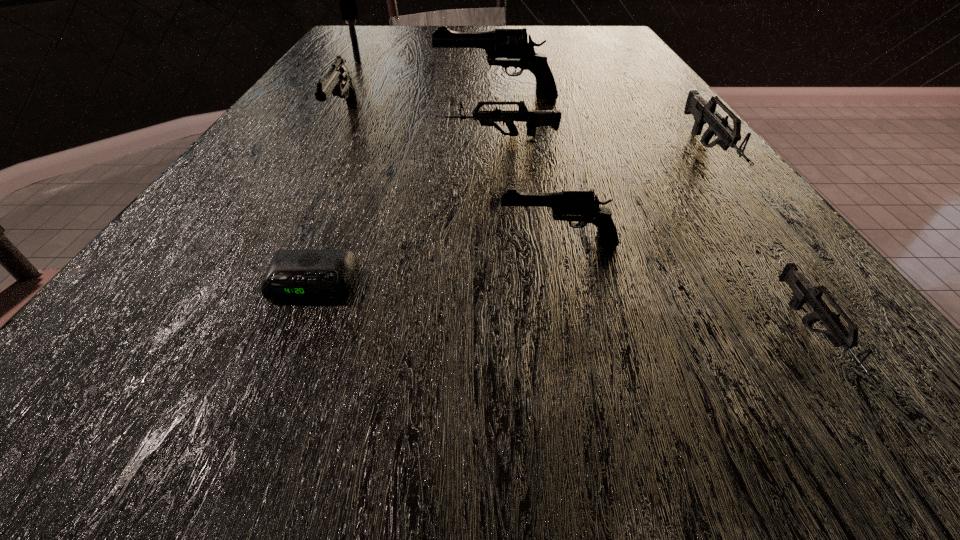
The height and width of the screenshot is (540, 960). I want to click on vacant area situated 0.120m at the end of the barrel of the third nearest object, so click(412, 244).

Identify the location of vacant region located 0.180m at the end of the barrel of the third nearest object. The image size is (960, 540). (369, 244).

The width and height of the screenshot is (960, 540). Identify the location of vacant area situated 0.180m at the end of the barrel of the third nearest object. (369, 244).

Locate an element on the screen. This screenshot has height=540, width=960. vacant position located 0.060m aimed along the barrel of the rightmost gun is located at coordinates (758, 213).

Identify the location of free space located 0.240m aimed along the barrel of the second smallest grey gun. (321, 136).

Locate an element on the screen. The height and width of the screenshot is (540, 960). free space located aimed along the barrel of the second smallest grey gun is located at coordinates (284, 136).

Locate an element on the screen. Image resolution: width=960 pixels, height=540 pixels. free space located aimed along the barrel of the second smallest grey gun is located at coordinates (316, 136).

Identify the location of free location located on the display of the alarm clock. The image size is (960, 540). pyautogui.click(x=254, y=427).

The width and height of the screenshot is (960, 540). What are the coordinates of `hairbrush at the left edge` in the screenshot? It's located at (347, 0).

Locate an element on the screen. The height and width of the screenshot is (540, 960). gun located in the left edge section of the desktop is located at coordinates click(x=338, y=80).